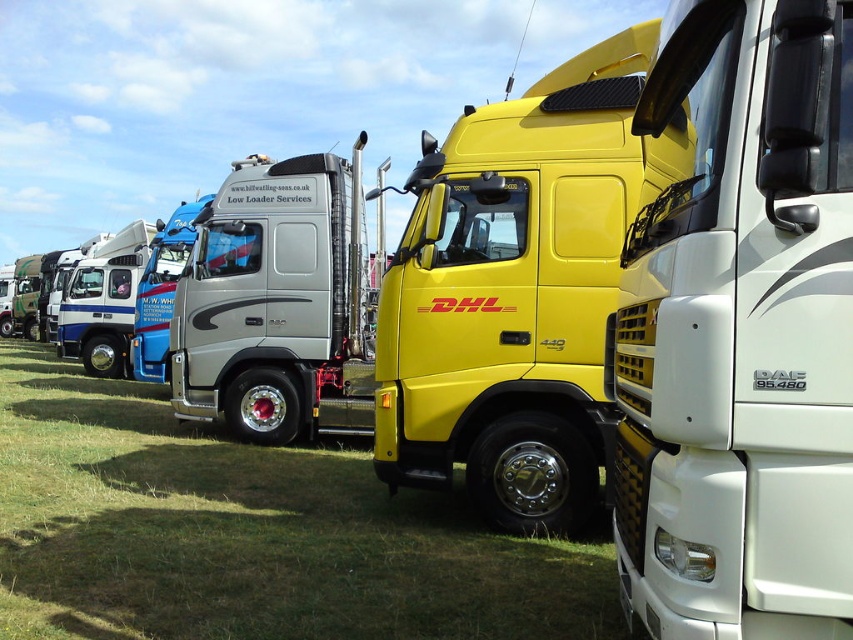
You are a delivery driver who needs to park your truck between the white glossy trailer truck at center and the silver metallic truck at center. Based on the scene description, which truck should you position your truck next to to ensure proper parking alignment?

The white glossy trailer truck at center is to the right of the silver metallic truck at center, so you should position your truck between them by placing it next to the silver metallic truck at center on its right side or next to the white glossy trailer truck at center on its left side.

You are standing 5 feet away from the point at coordinates point (693, 570). If you walk straight towards it, will you reach the point before walking 8 feet?

The distance of point (693, 570) from viewer is 7.29 feet. Since you are already 5 feet away and need to walk an additional 2.29 feet to reach it, which is less than 8 feet, yes, you will reach the point before walking 8 feet.